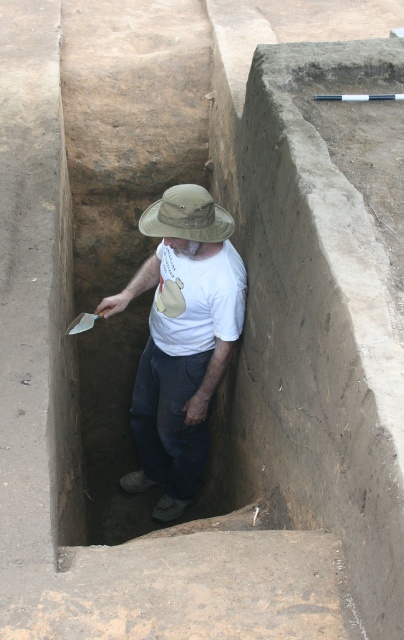
Between white matte t-shirt at center and khaki fabric hat at center, which one appears on the right side from the viewer's perspective?

Positioned to the right is khaki fabric hat at center.

Does white matte t-shirt at center lie behind khaki fabric hat at center?

Yes, it is behind khaki fabric hat at center.

At what (x,y) coordinates should I click in order to perform the action: click on white matte t-shirt at center. Please return your answer as a coordinate pair (x, y). This screenshot has width=404, height=640. Looking at the image, I should click on (181, 339).

Where is `white matte t-shirt at center`? white matte t-shirt at center is located at coordinates (181, 339).

I want to click on khaki fabric hat at center, so click(x=187, y=216).

Is point (187, 204) behind point (88, 312)?

No, it is in front of (88, 312).

The width and height of the screenshot is (404, 640). I want to click on khaki fabric hat at center, so click(x=187, y=216).

Which is more to the left, white matte t-shirt at center or white plastic shovel at lower center?

white plastic shovel at lower center is more to the left.

Which is behind, point (233, 266) or point (79, 316)?

The point (79, 316) is more distant.

At what (x,y) coordinates should I click in order to perform the action: click on white matte t-shirt at center. Please return your answer as a coordinate pair (x, y). The image size is (404, 640). Looking at the image, I should click on (181, 339).